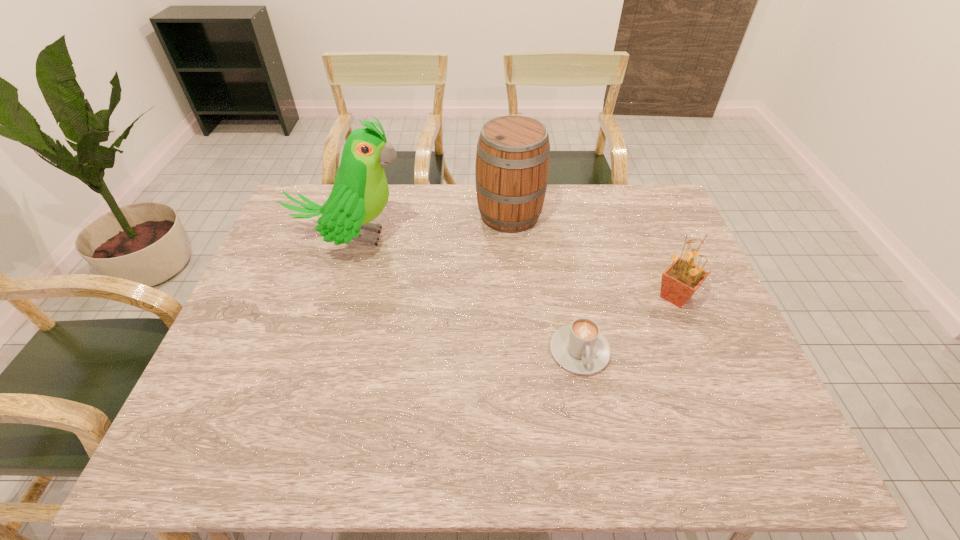
Locate an element on the screen. free space between the rightmost object and the parakeet is located at coordinates (514, 267).

You are a GUI agent. You are given a task and a screenshot of the screen. Output one action in this format:
    pyautogui.click(x=<x>, y=<y>)
    Task: Click on the vacant point located between the parakeet and the rightmost object
    The height and width of the screenshot is (540, 960).
    Given the screenshot: What is the action you would take?
    pyautogui.click(x=514, y=267)

Image resolution: width=960 pixels, height=540 pixels. What are the coordinates of `vacant space that's between the cappuccino and the rightmost object` in the screenshot? It's located at (628, 324).

Point out which object is positioned as the third nearest to the second tallest object. Please provide its 2D coordinates. Your answer should be formatted as a tuple, i.e. [(x, y)], where the tuple contains the x and y coordinates of a point satisfying the conditions above.

[(580, 348)]

You are a GUI agent. You are given a task and a screenshot of the screen. Output one action in this format:
    pyautogui.click(x=<x>, y=<y>)
    Task: Click on the object that is the closest one to the second nearest object
    
    Given the screenshot: What is the action you would take?
    pyautogui.click(x=580, y=348)